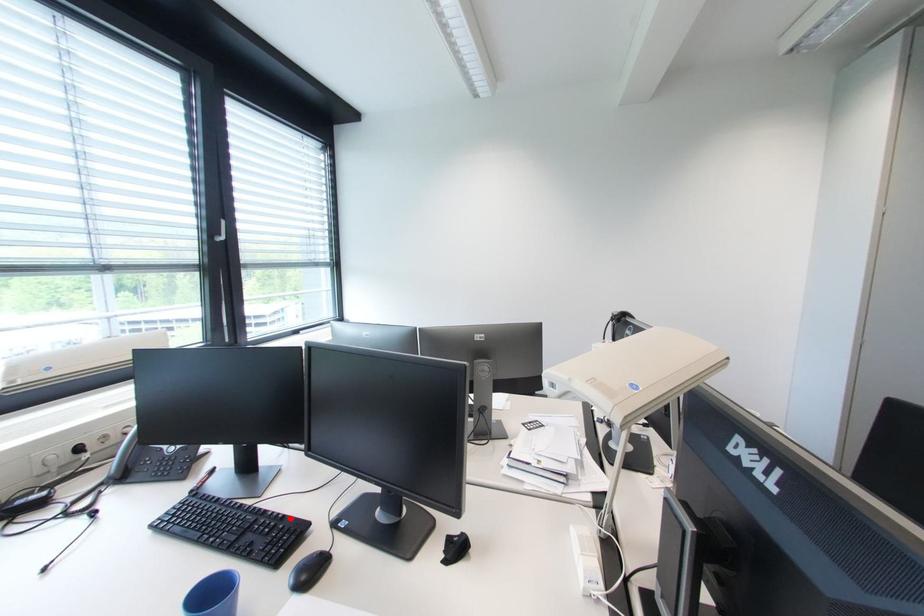
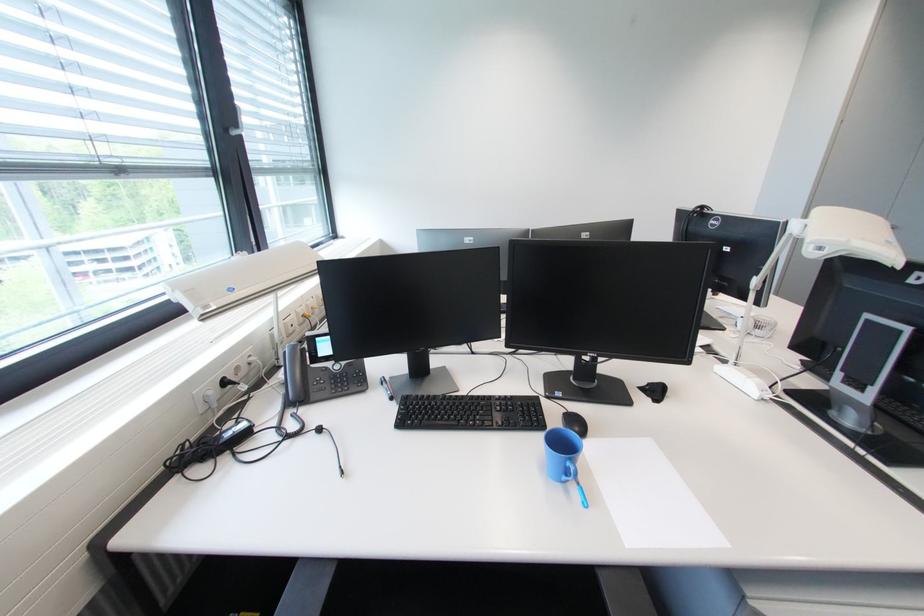
Locate, in the second image, the point that corresponds to the highlighted location in the first image.

(517, 398)